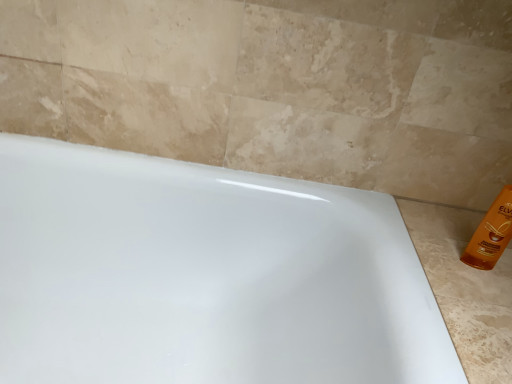
Question: Looking at their shapes, would you say orange glossy bottle at right is wider or thinner than white glossy bathtub at center?

Choices:
 (A) wide
 (B) thin

Answer: (B)

Question: In the image, is orange glossy bottle at right positioned in front of or behind white glossy bathtub at center?

Choices:
 (A) front
 (B) behind

Answer: (B)

Question: From the image's perspective, is orange glossy bottle at right positioned above or below white glossy bathtub at center?

Choices:
 (A) below
 (B) above

Answer: (B)

Question: Considering the positions of white glossy bathtub at center and orange glossy bottle at right in the image, is white glossy bathtub at center taller or shorter than orange glossy bottle at right?

Choices:
 (A) short
 (B) tall

Answer: (B)

Question: Do you think white glossy bathtub at center is within orange glossy bottle at right, or outside of it?

Choices:
 (A) inside
 (B) outside

Answer: (B)

Question: Is white glossy bathtub at center bigger or smaller than orange glossy bottle at right?

Choices:
 (A) small
 (B) big

Answer: (B)

Question: Considering the relative positions of white glossy bathtub at center and orange glossy bottle at right in the image provided, is white glossy bathtub at center to the left or to the right of orange glossy bottle at right?

Choices:
 (A) right
 (B) left

Answer: (B)